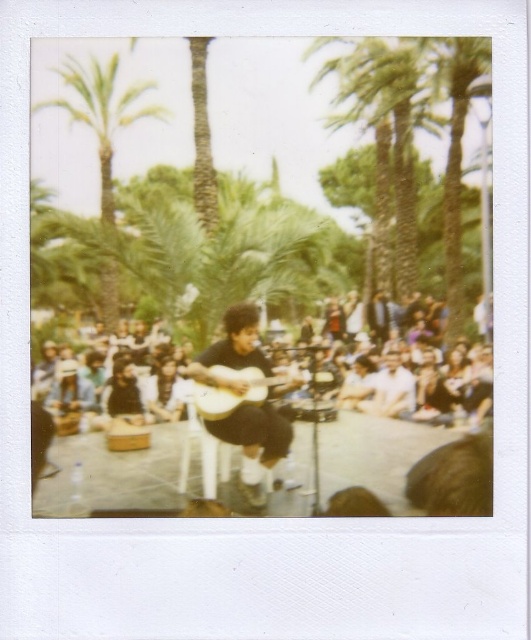
You are a photographer trying to capture a closeup of the palm tree in the background. However, you notice the dark brown fabric crowd at center is blocking your view. Can you move to a position where you can see the green leafy palm tree at upper left without the crowd obstructing your view?

The dark brown fabric crowd at center is closer to the viewer than the green leafy palm tree at upper left. To avoid obstruction, move to a position where the green leafy palm tree at upper left is not behind the closer crowd.